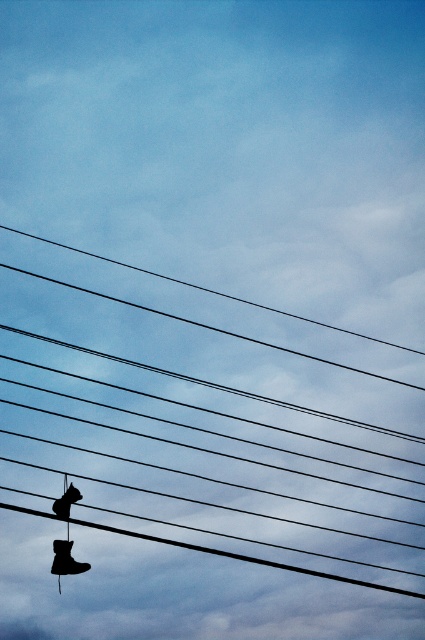
You are a maintenance worker checking power lines and notice two shoes hanging from them. You need to remove them safely. Which shoe, the black rubber boot at lower left or the matte black shoe at lower left, is easier to reach without moving the other?

The black rubber boot at lower left is easier to reach because the matte black shoe at lower left is behind it, making it less accessible without disturbing the boot.

You are a bird perched on a power line and want to land on the lower of the two shoes hanging from the power lines. Which shoe should you choose between the black rubber boot at lower left and the matte black shoe at lower left?

The matte black shoe at lower left is lower than the black rubber boot at lower left, so you should choose the matte black shoe at lower left to land on.

You are a maintenance worker tasked with retrieving the matte black shoe at lower left from the black wire at center. The safety protocol states that you must stay at least 10 meters away from any live power lines. Can you safely perform this task without violating the safety protocol?

The distance between the black wire at center and the matte black shoe at lower left is 10.16 meters, which exceeds the required 10 meters safety distance. Therefore, you can safely retrieve the shoe without violating the safety protocol.